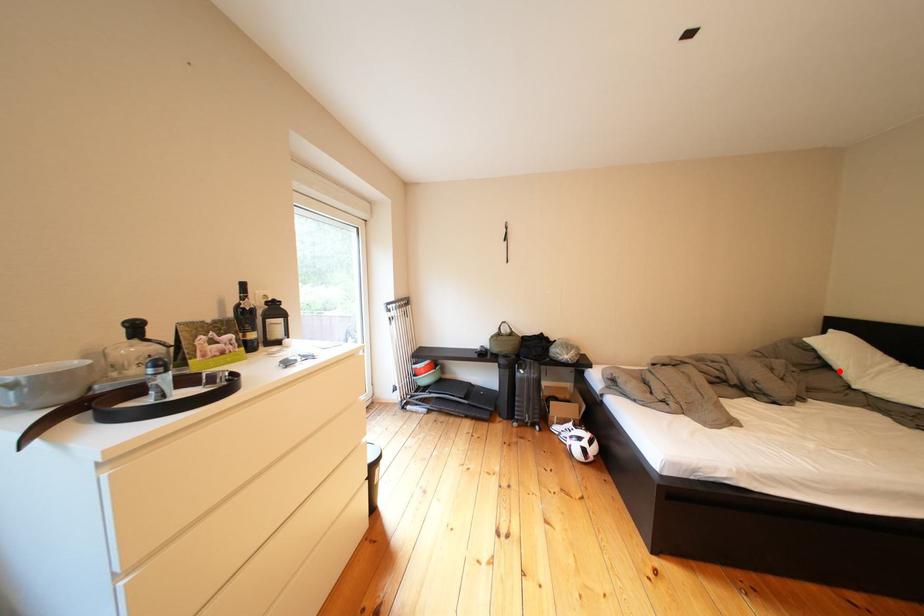
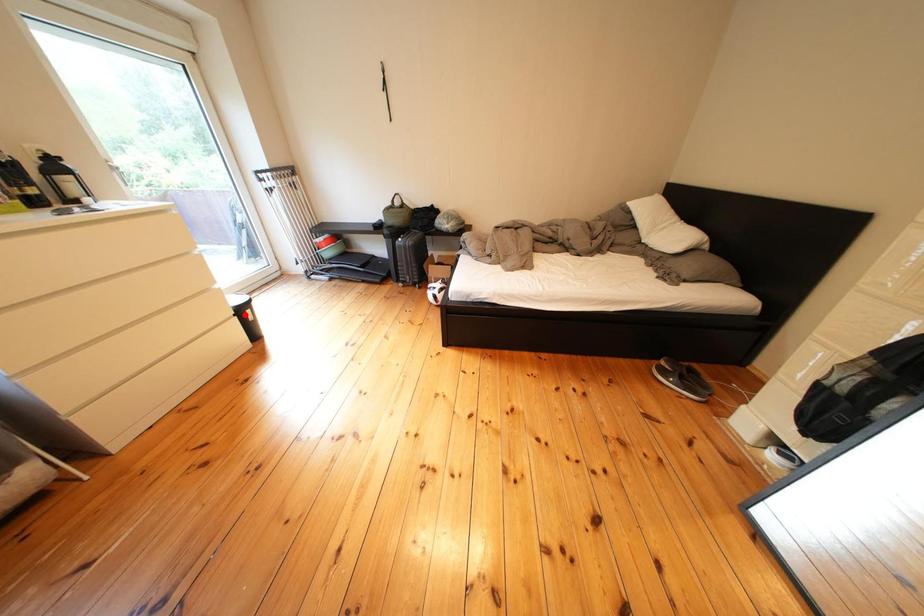
I am providing you with two images of the same scene from different viewpoints. A red point is marked on the first image and another point is marked on the second image. Is the marked point in image1 the same physical position as the marked point in image2?

No